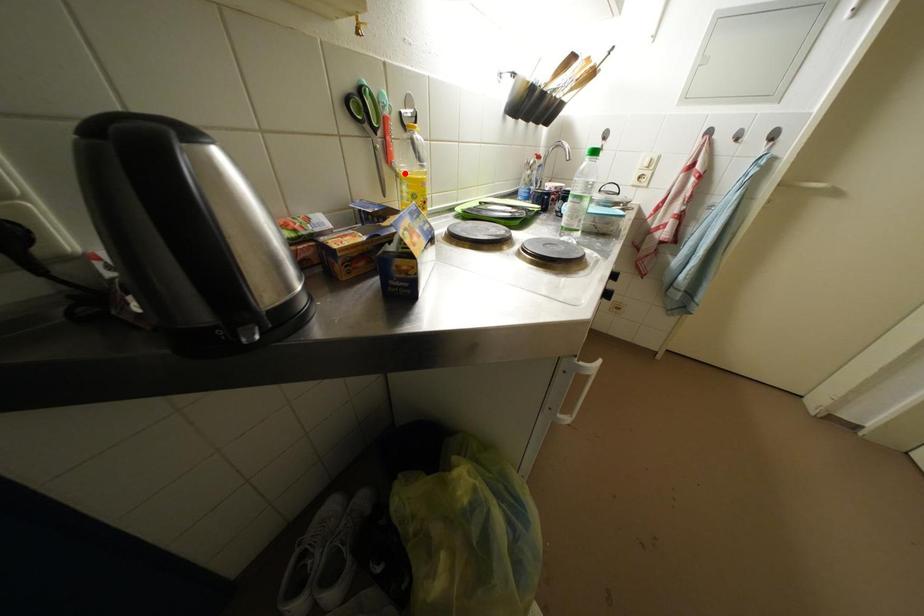
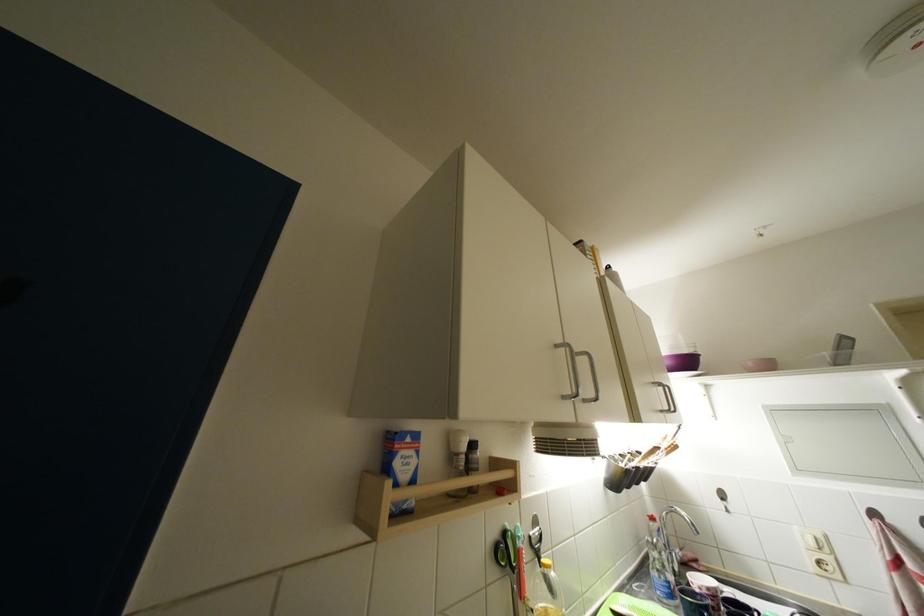
Find the pixel in the second image that matches the highlighted location in the first image.

(537, 610)